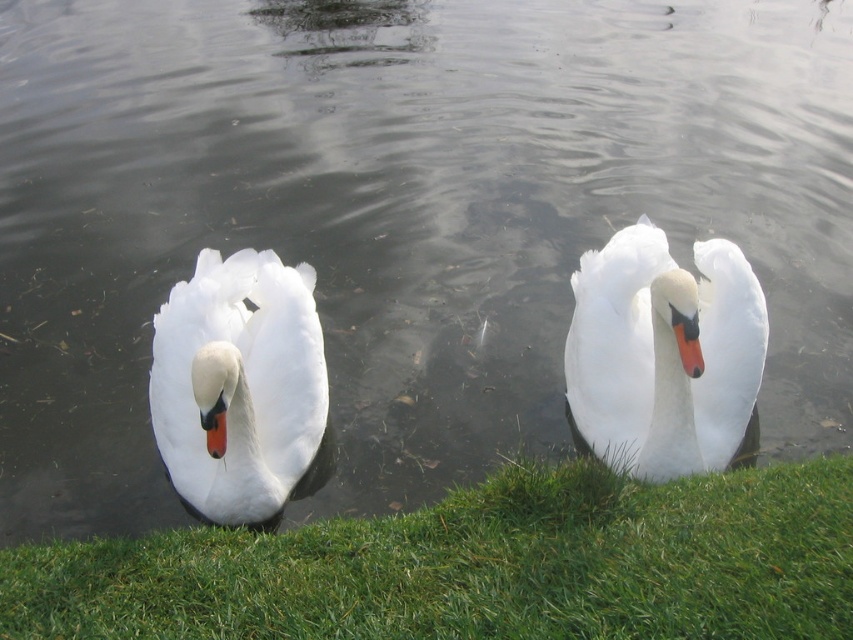
Question: Does green grass at lower center appear under white glossy swan at left?

Choices:
 (A) no
 (B) yes

Answer: (B)

Question: In this image, where is green grass at lower center located relative to white glossy swan at center?

Choices:
 (A) above
 (B) below

Answer: (B)

Question: Is green grass at lower center wider than white glossy swan at center?

Choices:
 (A) yes
 (B) no

Answer: (A)

Question: Among these points, which one is nearest to the camera?

Choices:
 (A) (184, 301)
 (B) (682, 320)

Answer: (B)

Question: Which of the following is the closest to the observer?

Choices:
 (A) green grass at lower center
 (B) white glossy swan at center

Answer: (A)

Question: Which of the following is the farthest from the observer?

Choices:
 (A) (459, 520)
 (B) (248, 298)

Answer: (B)